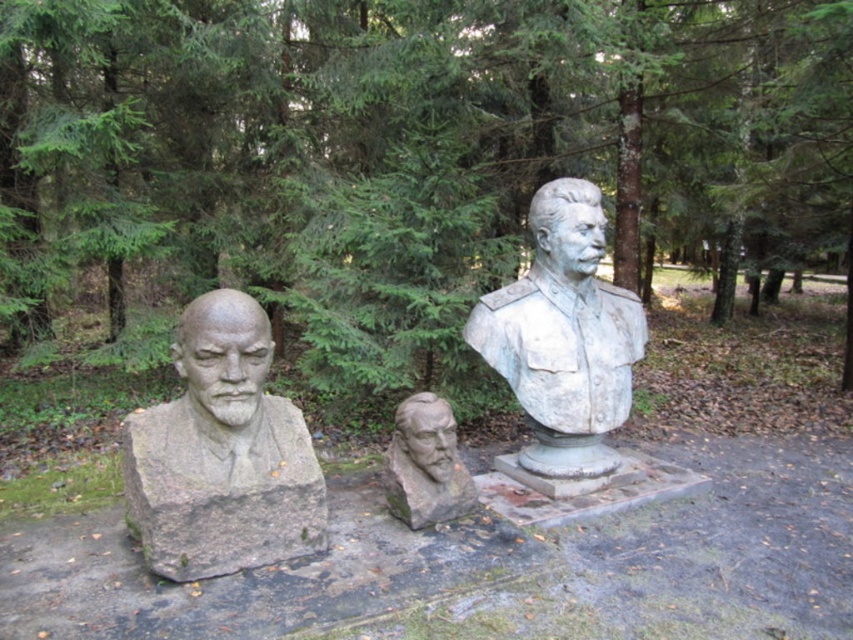
Does green textured tree at center come in front of gray stone bust at center?

No, it is behind gray stone bust at center.

Is point (318, 113) farther from camera compared to point (477, 324)?

Yes, point (318, 113) is farther from viewer.

The height and width of the screenshot is (640, 853). In order to click on green textured tree at center in this screenshot , I will do `click(413, 147)`.

Which is more to the right, green textured tree at center or stone textured bust at center?

stone textured bust at center

The image size is (853, 640). In order to click on green textured tree at center in this screenshot , I will do `click(413, 147)`.

Which is in front, point (384, 173) or point (444, 440)?

Point (444, 440)

This screenshot has height=640, width=853. I want to click on green textured tree at center, so [413, 147].

Is point (419, 3) more distant than point (163, 445)?

Yes, point (419, 3) is farther from viewer.

Does green textured tree at center appear over gray stone bust at left?

Result: Yes, green textured tree at center is above gray stone bust at left.

Measure the distance between green textured tree at center and camera.

4.32 meters

The height and width of the screenshot is (640, 853). I want to click on green textured tree at center, so click(x=413, y=147).